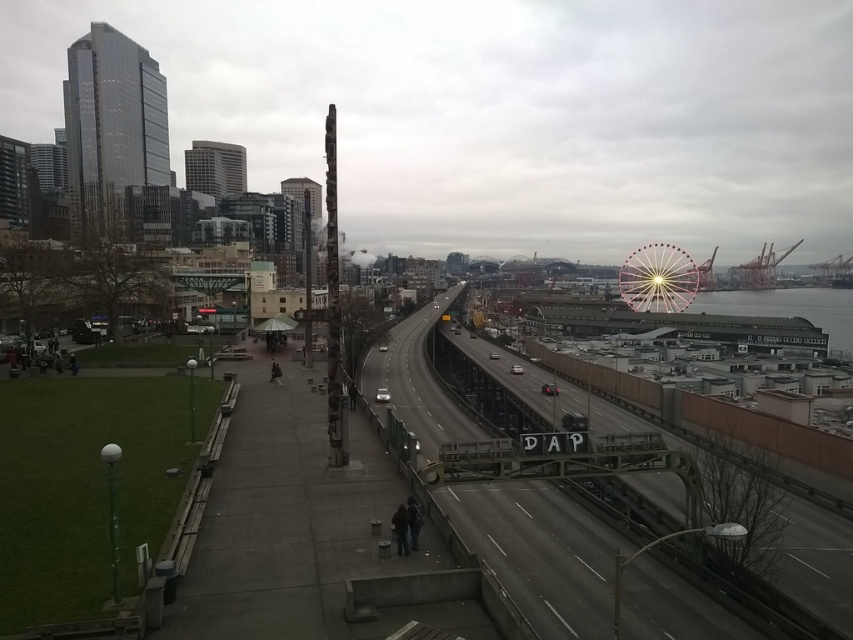
Can you confirm if metallic gray train track at center is positioned to the left of pink metallic ferris wheel at upper right?

Yes, metallic gray train track at center is to the left of pink metallic ferris wheel at upper right.

Is metallic gray train track at center positioned before pink metallic ferris wheel at upper right?

That is True.

Is point (370, 356) positioned behind point (645, 250)?

No, (370, 356) is in front of (645, 250).

Find the location of a particular element. This screenshot has width=853, height=640. metallic gray train track at center is located at coordinates (419, 376).